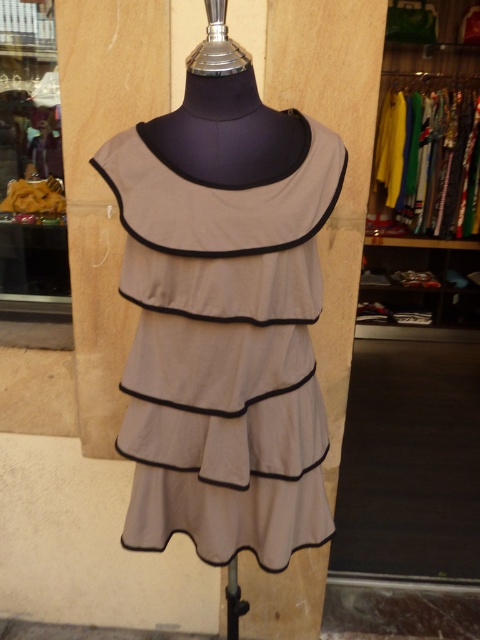
Who is shorter, beige cotton dress at center or matte yellow purse at left?

With less height is matte yellow purse at left.

How far apart are beige cotton dress at center and matte yellow purse at left?

The distance of beige cotton dress at center from matte yellow purse at left is 33.68 inches.

Who is more forward, (300, 468) or (6, 173)?

Point (300, 468) is in front.

At what (x,y) coordinates should I click in order to perform the action: click on beige cotton dress at center. Please return your answer as a coordinate pair (x, y). Looking at the image, I should click on (224, 353).